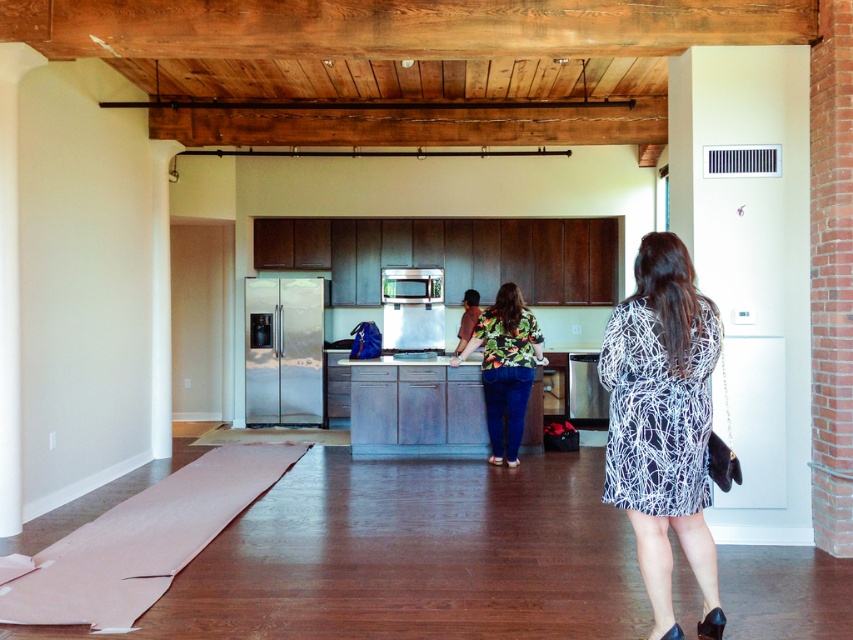
Is pink fabric yoga mat at lower left bigger than satin silver trash can at lower center?

Yes, pink fabric yoga mat at lower left is bigger than satin silver trash can at lower center.

Locate an element on the screen. pink fabric yoga mat at lower left is located at coordinates (140, 541).

Which is more to the right, stainless steel refrigerator at left or floral print dress at center?

Positioned to the right is floral print dress at center.

Is stainless steel refrigerator at left thinner than floral print dress at center?

Incorrect, stainless steel refrigerator at left's width is not less than floral print dress at center's.

Does point (274, 387) come behind point (486, 337)?

Yes, it is behind point (486, 337).

Where is `stainless steel refrigerator at left`? The image size is (853, 640). stainless steel refrigerator at left is located at coordinates (283, 349).

Between black printed dress at lower right and floral print dress at center, which one has more height?

black printed dress at lower right is taller.

Is black printed dress at lower right wider than floral print dress at center?

Result: No, black printed dress at lower right is not wider than floral print dress at center.

Is point (614, 385) farther from camera compared to point (488, 348)?

No, (614, 385) is closer to viewer.

I want to click on black printed dress at lower right, so click(663, 422).